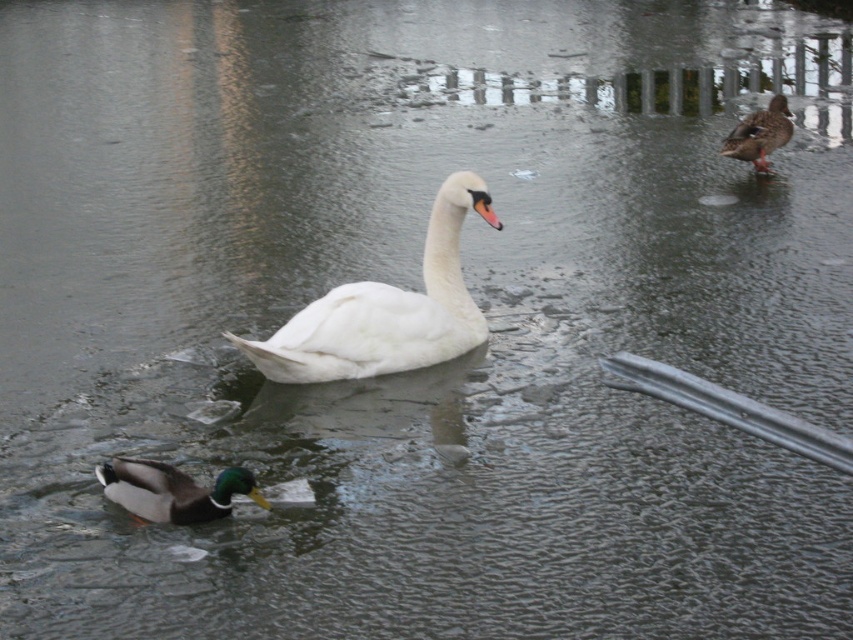
Does white smooth swan at center have a larger size compared to green glossy duck at lower left?

Correct, white smooth swan at center is larger in size than green glossy duck at lower left.

Which is in front, point (343, 344) or point (97, 474)?

Positioned in front is point (97, 474).

Which is in front, point (450, 218) or point (138, 467)?

Positioned in front is point (138, 467).

Identify the location of white smooth swan at center. (386, 310).

Who is higher up, white smooth swan at center or brown matte duck at upper right?

Positioned higher is brown matte duck at upper right.

Who is more forward, (x=282, y=326) or (x=730, y=132)?

Point (x=282, y=326) is in front.

This screenshot has height=640, width=853. I want to click on white smooth swan at center, so click(x=386, y=310).

Find the location of a particular element. white smooth swan at center is located at coordinates (386, 310).

Does green glossy duck at lower left have a smaller size compared to brown matte duck at upper right?

Yes, green glossy duck at lower left is smaller than brown matte duck at upper right.

What do you see at coordinates (172, 490) in the screenshot?
I see `green glossy duck at lower left` at bounding box center [172, 490].

You are a GUI agent. You are given a task and a screenshot of the screen. Output one action in this format:
    pyautogui.click(x=<x>, y=<y>)
    Task: Click on the green glossy duck at lower left
    The width and height of the screenshot is (853, 640).
    Given the screenshot: What is the action you would take?
    pyautogui.click(x=172, y=490)